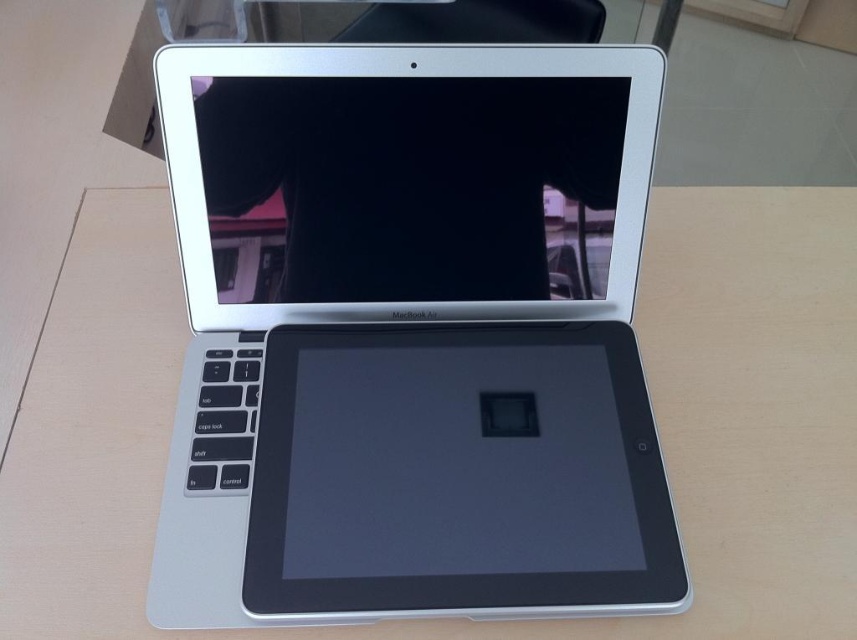
Question: Is silver metallic laptop at center positioned at the back of silver metallic tablet at center?

Choices:
 (A) no
 (B) yes

Answer: (A)

Question: Which object appears closest to the camera in this image?

Choices:
 (A) slate matte tablet at center
 (B) silver metallic laptop at center
 (C) silver metallic tablet at center

Answer: (A)

Question: Which point is farther from the camera taking this photo?

Choices:
 (A) (334, 532)
 (B) (478, 196)
 (C) (253, 100)

Answer: (B)

Question: Does silver metallic laptop at center have a lesser width compared to slate matte tablet at center?

Choices:
 (A) no
 (B) yes

Answer: (A)

Question: Which of the following is the farthest from the observer?

Choices:
 (A) (530, 570)
 (B) (229, 140)
 (C) (492, 410)

Answer: (C)

Question: Does silver metallic laptop at center appear on the left side of silver metallic tablet at center?

Choices:
 (A) no
 (B) yes

Answer: (A)